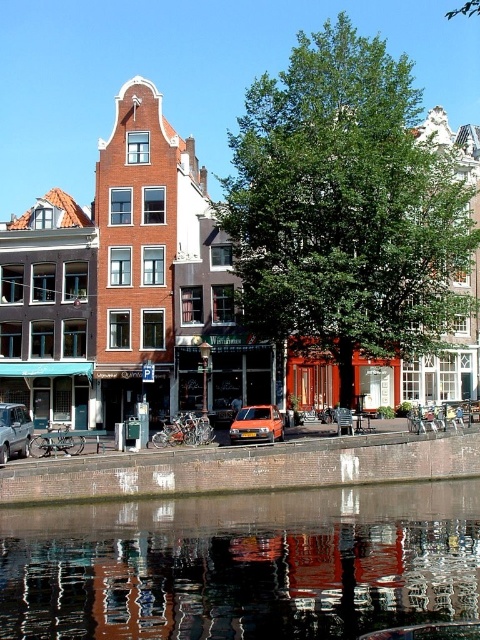
You are a tourist standing on the sidewalk next to the canal and see the orange matte car at center and the silver metallic car at lower left. Which car is positioned higher relative to the other?

The orange matte car at center is above the silver metallic car at lower left.

Looking at this image, you are a delivery driver who needs to park your truck, which is 2 meters tall, in this area. You see the orange matte car at center and the silver metallic car at lower left. Can you safely park your truck between them without hitting the roof?

The orange matte car at center is not as tall as silver metallic car at lower left. Since the silver metallic car at lower left is taller, the minimum height clearance between the cars would be determined by the tallest object, which is the silver metallic car. If your truck is 2 meters tall, you need to ensure there is enough vertical space. However, without knowing the exact height of the silver metallic car, it is uncertain if the truck can fit. Therefore, it might not be safe to park there without more